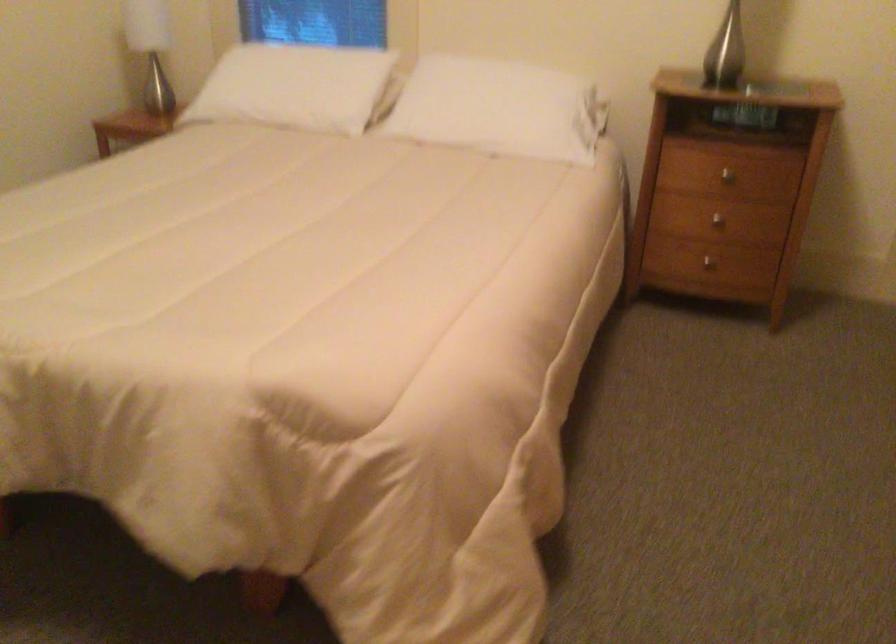
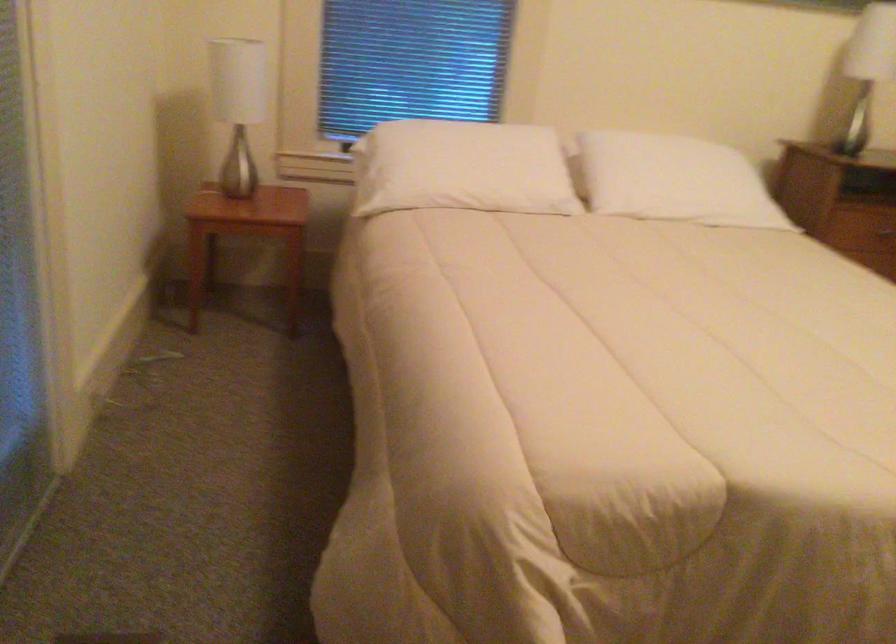
Where in the second image is the point corresponding to [698,192] from the first image?

(883, 232)